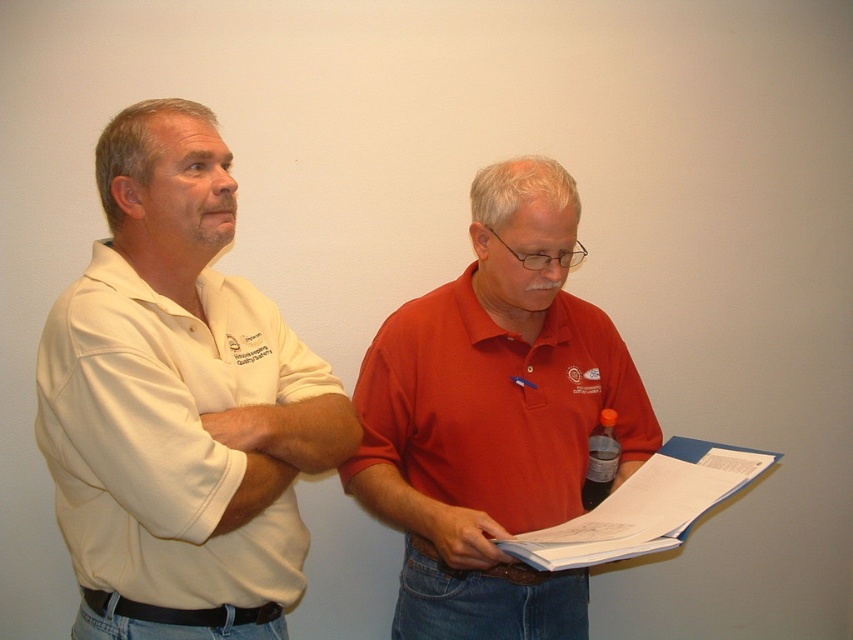
You are a photographer setting up a photo shoot in this room. You need to ensure that the matte red polo shirt at center and the matte red shirt at center are both visible in the frame. Given their widths, which one might require more space in the composition to avoid being cropped?

The matte red polo shirt at center has a greater width than the matte red shirt at center, so it would require more space in the composition to avoid being cropped.

Consider the image. You are organizing a meeting and need to place a name tag on the table between the white paper at center and the matte red shirt at center. Since the name tag is 10 cm tall, which object should you place it next to to ensure it is visible?

The white paper at center has a lesser height compared to matte red shirt at center, so placing the name tag next to the matte red shirt at center would ensure better visibility since it is taller than the white paper at center.

You are standing in a room with two men. You need to hand a document to the man wearing the matte red polo shirt at center. Which direction should you walk to reach him from the matte red shirt at center?

The matte red polo shirt at center is to the right of the matte red shirt at center. So, you should walk to the right to reach the matte red polo shirt at center.